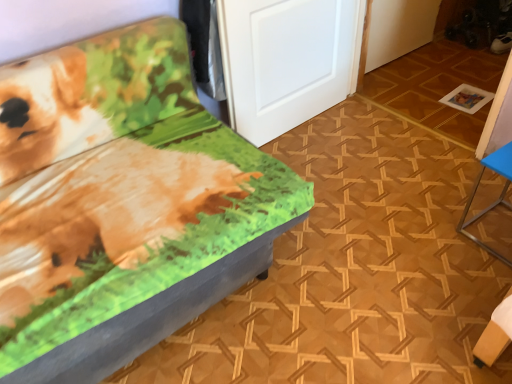
The width and height of the screenshot is (512, 384). Identify the location of free point below white matte door at center (from a real-world perspective). (305, 127).